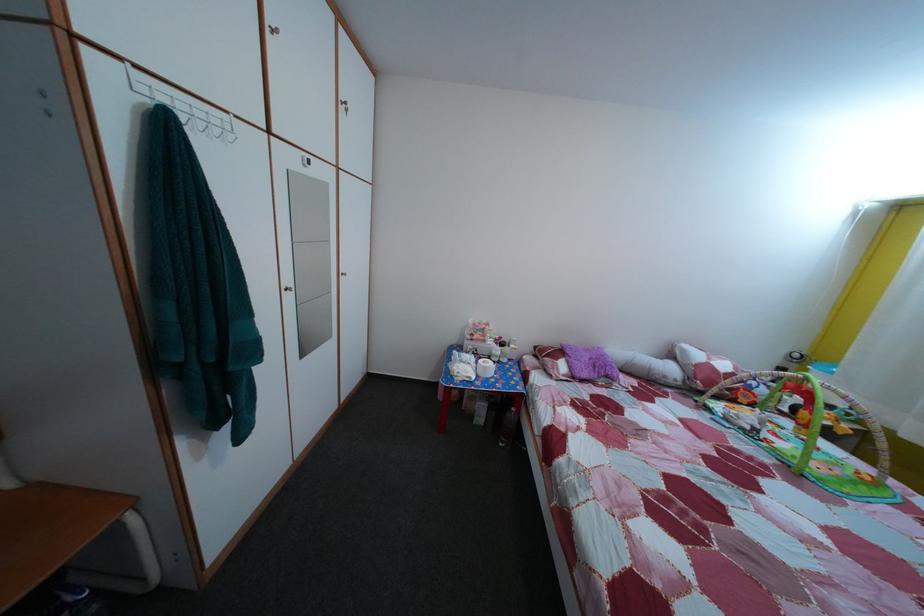
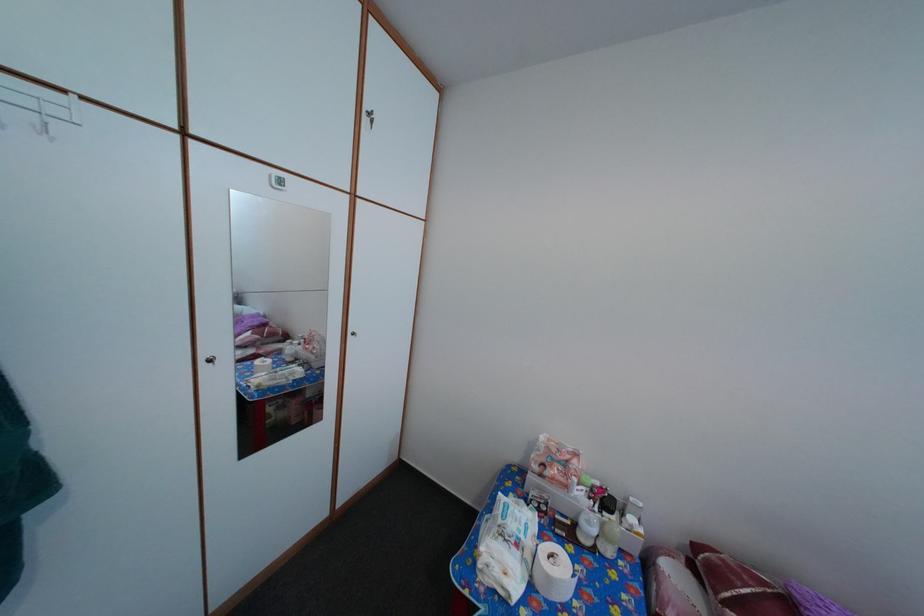
Where in the second image is the point corresponding to pixel 462 384 from the first image?

(484, 572)